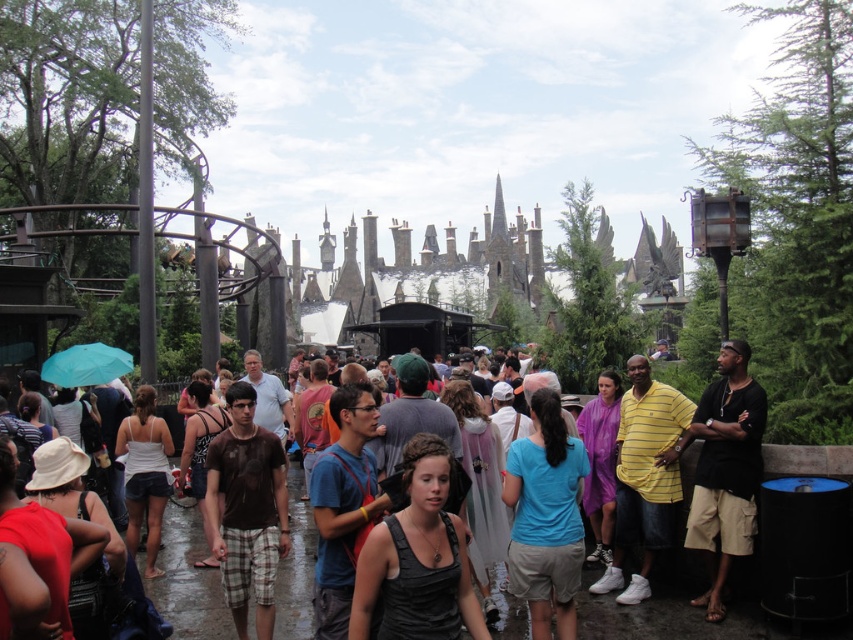
Question: From the image, what is the correct spatial relationship of black matte tank top at center in relation to purple waterproof poncho at center?

Choices:
 (A) below
 (B) above

Answer: (A)

Question: Which is nearer to the blue fabric shirt at center?

Choices:
 (A) brown cotton t-shirt at center
 (B) purple waterproof poncho at center
 (C) white fabric dress at center
 (D) black matte tank top at center

Answer: (B)

Question: Is blue fabric shirt at center wider than brown cotton t-shirt at center?

Choices:
 (A) no
 (B) yes

Answer: (A)

Question: Is black cotton shirt at center above purple waterproof poncho at center?

Choices:
 (A) no
 (B) yes

Answer: (A)

Question: Among these objects, which one is farthest from the camera?

Choices:
 (A) dark brown leather backpack at center
 (B) teal fabric umbrella at lower left

Answer: (B)

Question: Which object is closer to the camera taking this photo?

Choices:
 (A) brown cotton t-shirt at center
 (B) purple waterproof poncho at center
 (C) black matte tank top at center

Answer: (C)